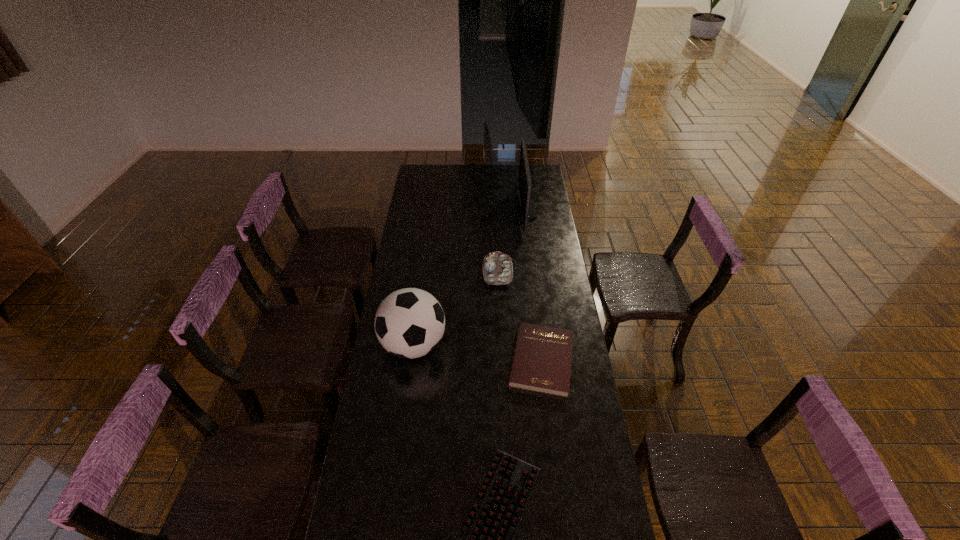
Image resolution: width=960 pixels, height=540 pixels. I want to click on blank region between the monitor and the hardback book, so click(534, 285).

Find the location of a particular element. vacant space in between the chinaware and the second shortest object is located at coordinates (519, 316).

The width and height of the screenshot is (960, 540). I want to click on blank region between the monitor and the second farthest object, so coord(512,241).

This screenshot has width=960, height=540. Identify the location of free area in between the farthest object and the hardback book. (534, 285).

Locate an element on the screen. free space between the hardback book and the farthest object is located at coordinates (534, 285).

Find the location of `free space between the soccer ball and the farthest object`. free space between the soccer ball and the farthest object is located at coordinates (469, 278).

Find the location of a particular element. The width and height of the screenshot is (960, 540). vacant area that lies between the third shortest object and the farthest object is located at coordinates (512, 241).

Image resolution: width=960 pixels, height=540 pixels. What are the coordinates of `vacant space that's between the third shortest object and the monitor` in the screenshot? It's located at (512, 241).

The height and width of the screenshot is (540, 960). What are the coordinates of `the second closest object relative to the fourth tallest object` in the screenshot? It's located at (497, 267).

Locate which object is the second closest to the monitor. Please provide its 2D coordinates. Your answer should be formatted as a tuple, i.e. [(x, y)], where the tuple contains the x and y coordinates of a point satisfying the conditions above.

[(542, 358)]